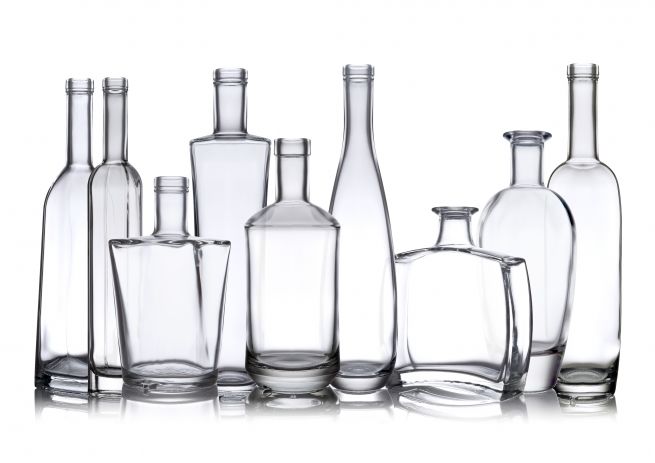
I want to click on glass bottle, so click(50, 238), click(115, 198), click(171, 267), click(217, 168), click(288, 257), click(373, 243), click(447, 312), click(540, 223), click(591, 264).